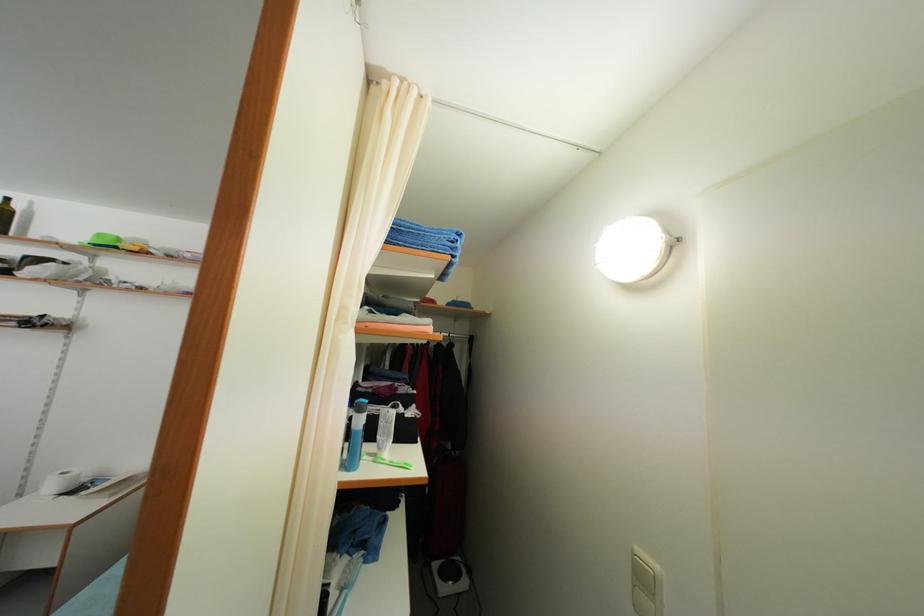
Where would you lift the toilet paper roll? Please return your answer as a coordinate pair (x, y).

(61, 482)